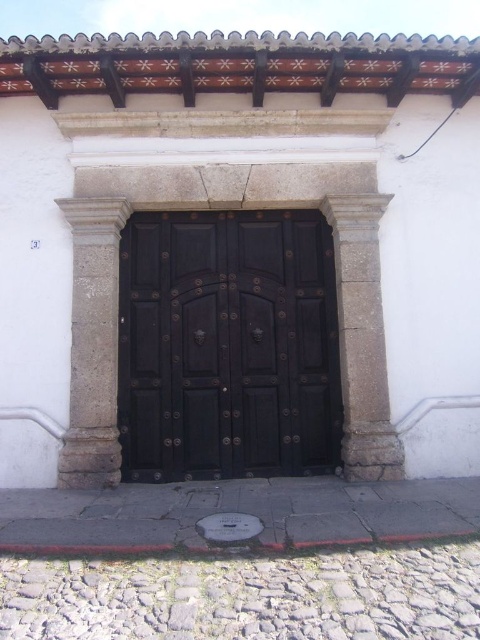
Question: Observing the image, what is the correct spatial positioning of black wood door at center in reference to gray stone pillar at left?

Choices:
 (A) above
 (B) below

Answer: (B)

Question: Among these objects, which one is farthest from the camera?

Choices:
 (A) gray stone pillar at left
 (B) black wood door at center

Answer: (B)

Question: Is black wood door at center to the right of gray stone pillar at left from the viewer's perspective?

Choices:
 (A) yes
 (B) no

Answer: (A)

Question: Which point is farther from the camera taking this photo?

Choices:
 (A) (332, 429)
 (B) (91, 216)

Answer: (A)

Question: Which point is farther from the camera taking this photo?

Choices:
 (A) (73, 321)
 (B) (245, 388)

Answer: (B)

Question: Is black wood door at center to the left of gray stone pillar at left from the viewer's perspective?

Choices:
 (A) no
 (B) yes

Answer: (A)